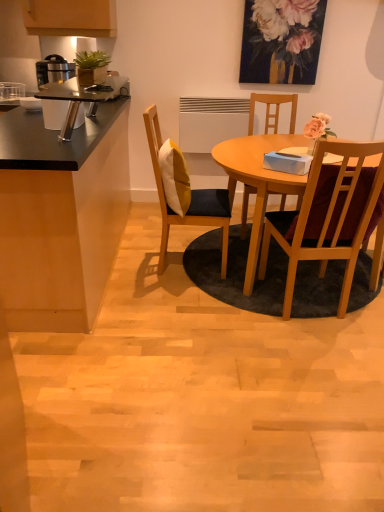
At what (x,y) coordinates should I click in order to perform the action: click on vacant region to the left of wooden chair with cushion at center, the 3th chair from the right. Please return your answer as a coordinate pair (x, y). The width and height of the screenshot is (384, 512). Looking at the image, I should click on pyautogui.click(x=125, y=262).